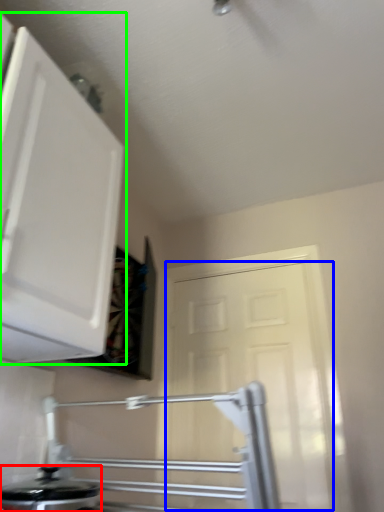
Question: Based on their relative distances, which object is farther from kitchen appliance (highlighted by a red box)? Choose from door (highlighted by a blue box) and cabinetry (highlighted by a green box).

Choices:
 (A) door
 (B) cabinetry

Answer: (A)